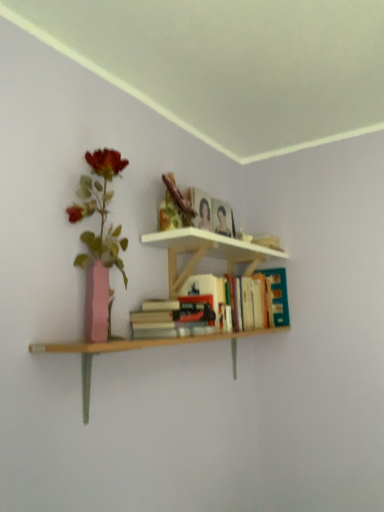
Question: Considering the relative positions of hardcover book at upper center and hardcover book at upper right, the second book when ordered from front to back, in the image provided, is hardcover book at upper center to the left or to the right of hardcover book at upper right, the second book when ordered from front to back,?

Choices:
 (A) right
 (B) left

Answer: (B)

Question: Choose the correct answer: Is hardcover book at upper center inside hardcover book at upper right, the second book when ordered from front to back, or outside it?

Choices:
 (A) outside
 (B) inside

Answer: (A)

Question: Estimate the real-world distances between objects in this image. Which object is closer to the hardcover book at upper right, the second book when ordered from front to back?

Choices:
 (A) hardcover book at center, which ranks as the 1th book in front-to-back order
 (B) hardcover book at upper center

Answer: (A)

Question: Based on their relative distances, which object is nearer to the hardcover book at upper center?

Choices:
 (A) hardcover book at center, acting as the 2th book starting from the back
 (B) hardcover book at upper right, which is the 1th book from back to front

Answer: (B)